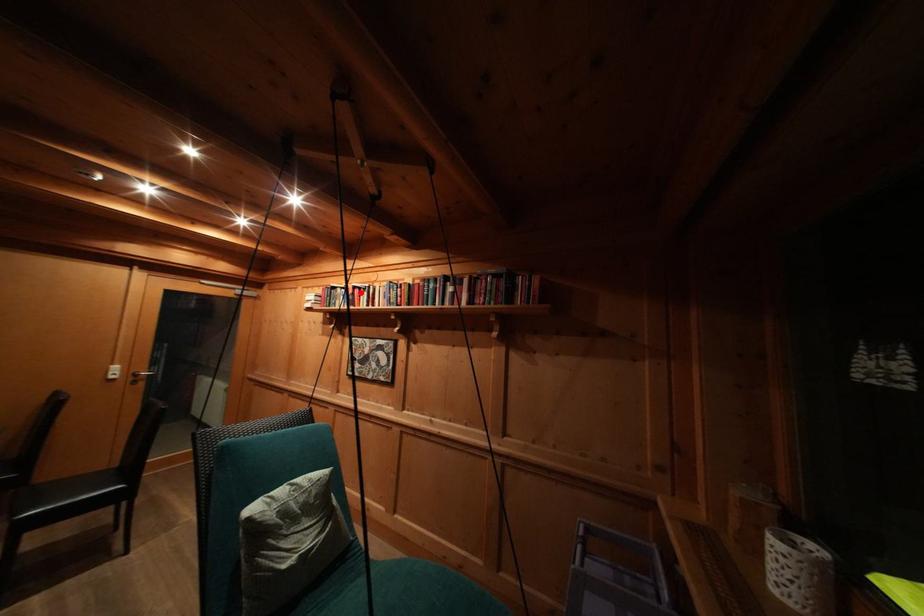
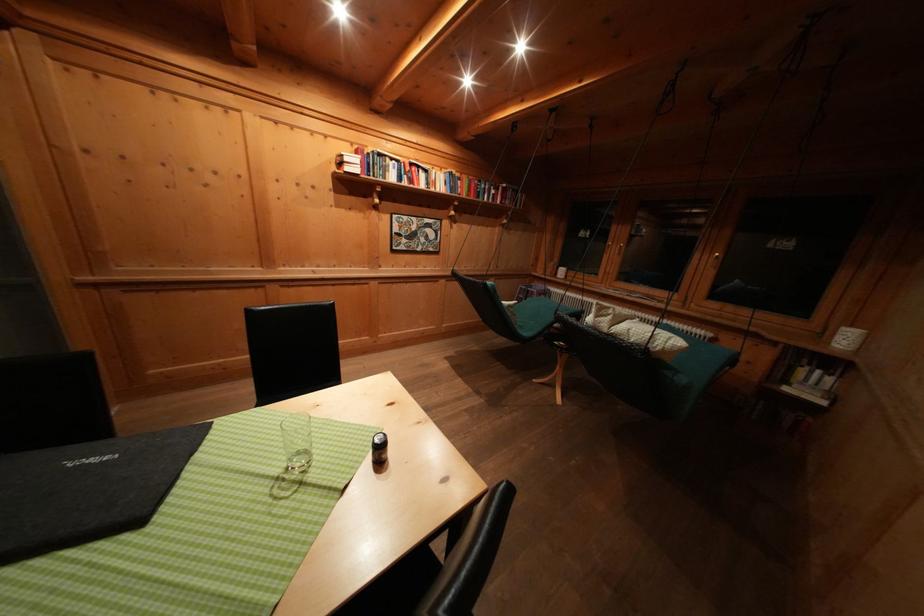
Locate, in the second image, the point that corresponds to the highlighted location in the first image.

(418, 169)